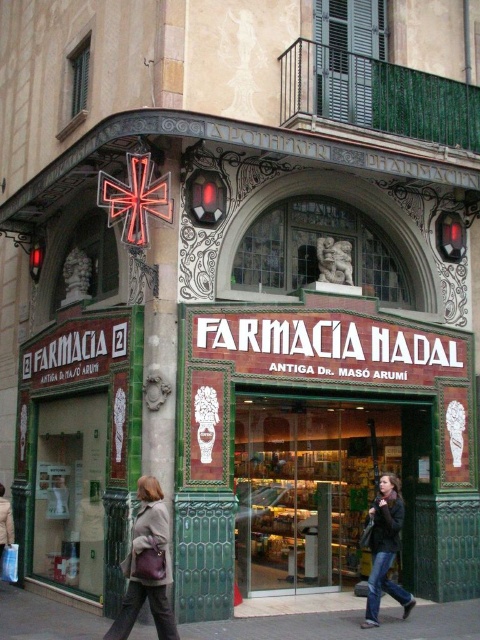
You are standing in front of Farmacia Nadal pharmacy and see both the leather jacket at lower center and the dark brown leather jacket at lower right. Which one is closer to you?

The leather jacket at lower center is closer to you because it is in front of the dark brown leather jacket at lower right.

You are standing in front of Farmacia Nadal and need to place a small package on the ground near the dark brown leather jacket at lower right. Where should you put it so that it stays close to the jacket but also rests on the concrete pavement at lower center?

Place the package on the concrete pavement at lower center directly beneath the dark brown leather jacket at lower right, as the pavement is located below the jacket and will support the package while keeping it near the jacket.